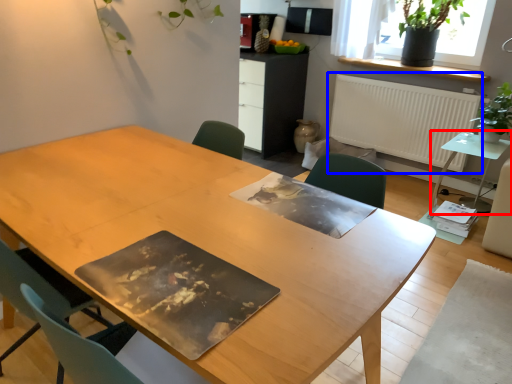
Question: Which object is closer to the camera taking this photo, table (highlighted by a red box) or radiator (highlighted by a blue box)?

Choices:
 (A) table
 (B) radiator

Answer: (A)